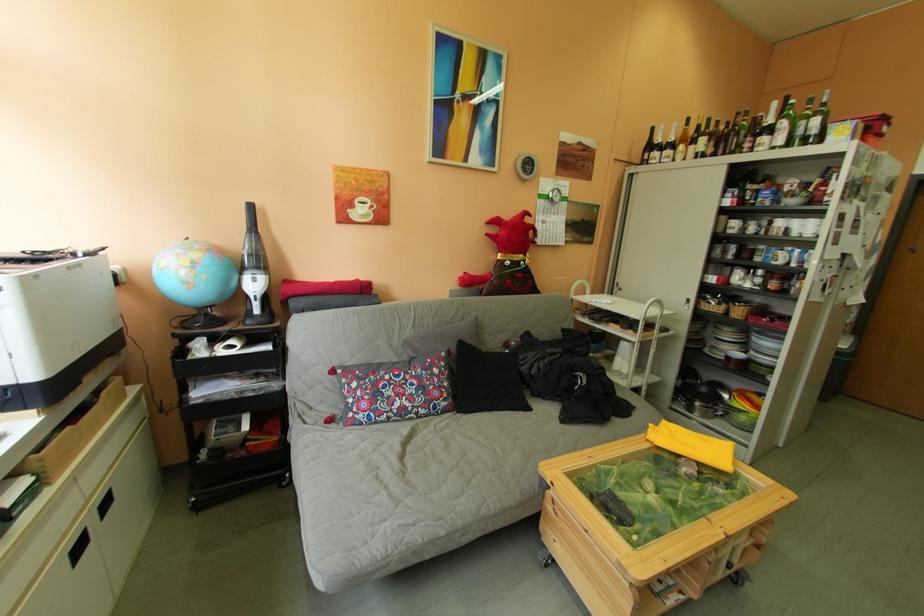
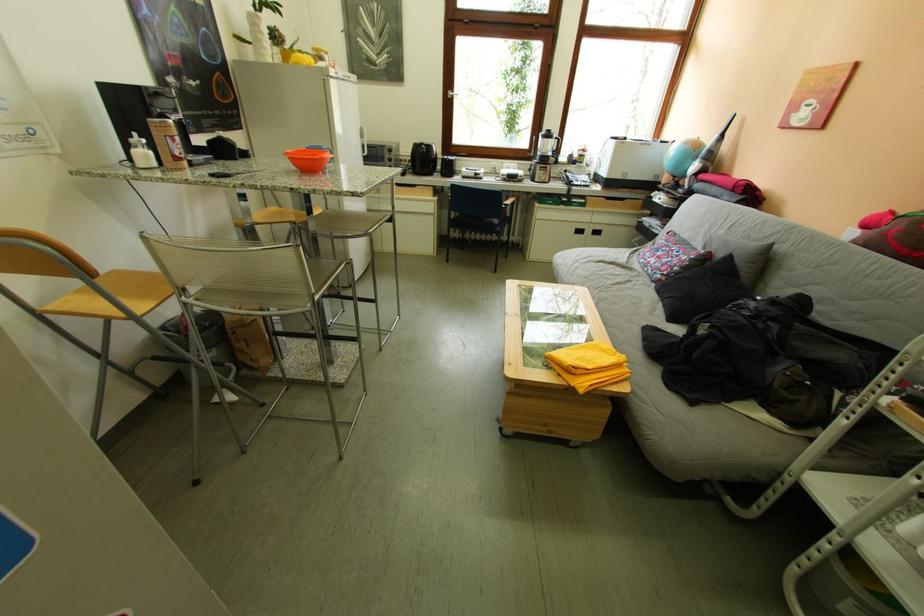
Where in the second image is the point corresponding to (404,413) from the first image?

(659, 262)